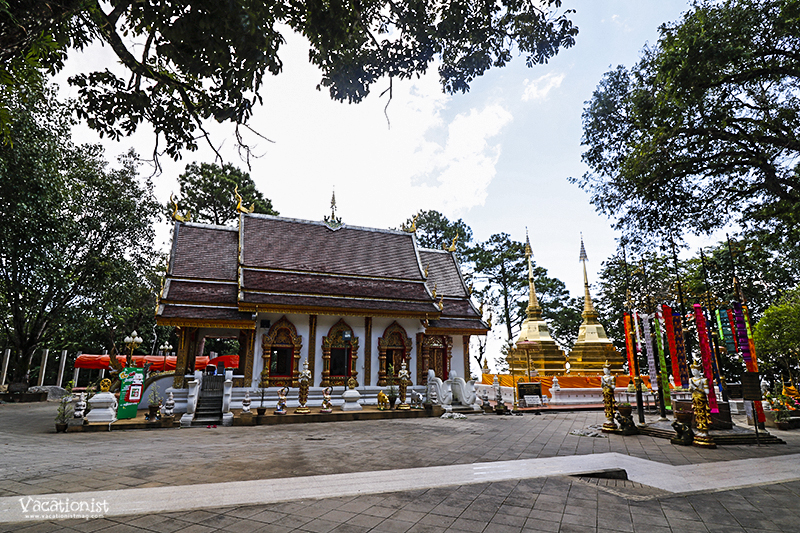
Find the location of `golden arched windows`. golden arched windows is located at coordinates coord(286,354), coord(345,361), coord(390,367).